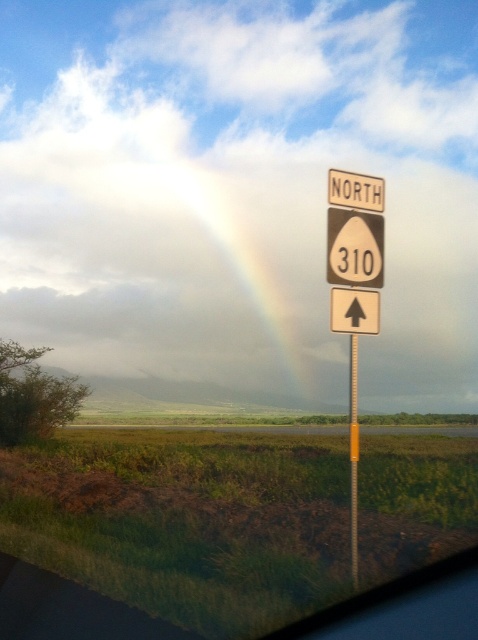
Is point (329, 301) farther from camera compared to point (349, 451)?

No, it is not.

Between point (362, 300) and point (351, 506), which one is positioned in front?

Point (351, 506) is more forward.

Find the location of `white plastic arrow at center`. white plastic arrow at center is located at coordinates (354, 310).

Locate an element on the screen. white plastic arrow at center is located at coordinates (354, 310).

Which is above, brown paper speed limit sign at upper right or yellow plastic pole at right?

brown paper speed limit sign at upper right is above.

How much distance is there between brown paper speed limit sign at upper right and yellow plastic pole at right?

brown paper speed limit sign at upper right and yellow plastic pole at right are 35.56 inches apart from each other.

Which is behind, point (367, 216) or point (352, 342)?

The point (367, 216) is behind.

I want to click on brown paper speed limit sign at upper right, so click(355, 248).

Can you confirm if white plastic sign at upper center is positioned below yellow plastic pole at right?

Incorrect, white plastic sign at upper center is not positioned below yellow plastic pole at right.

Where is `white plastic sign at upper center`? The height and width of the screenshot is (640, 478). white plastic sign at upper center is located at coordinates (356, 189).

Who is more distant from viewer, (367, 196) or (356, 472)?

The point (367, 196) is more distant.

The height and width of the screenshot is (640, 478). What are the coordinates of `white plastic sign at upper center` in the screenshot? It's located at (356, 189).